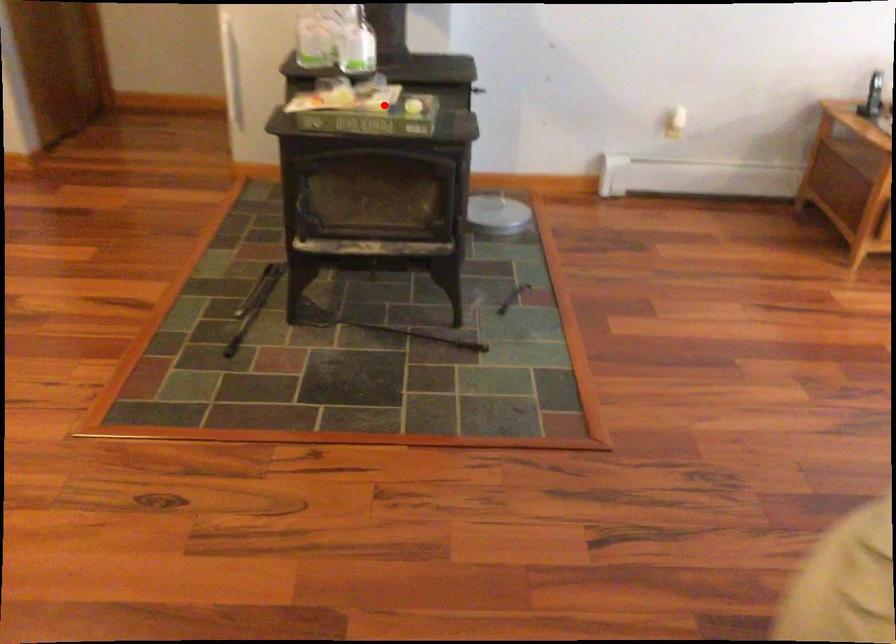
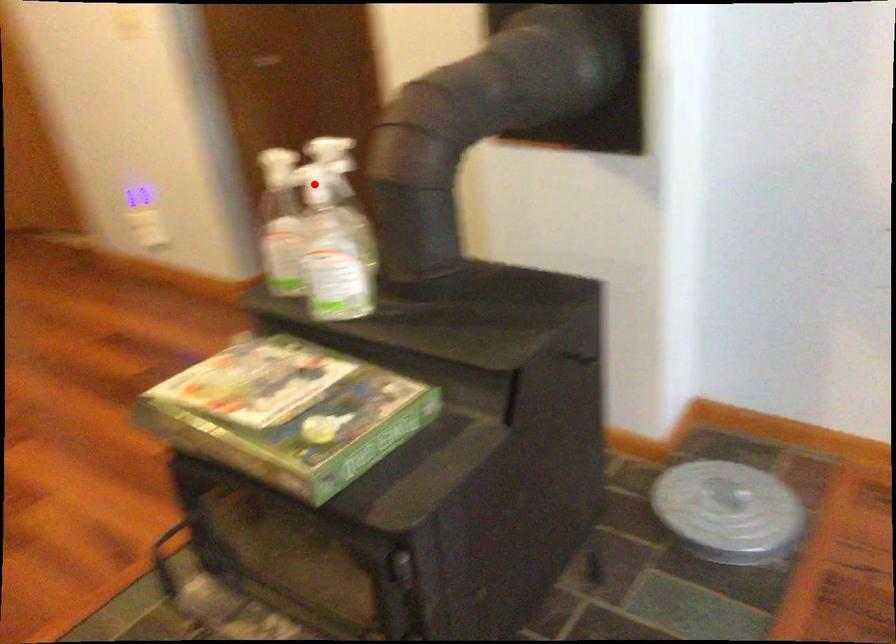
I am providing you with two images of the same scene from different viewpoints. A red point is marked on the first image and another point is marked on the second image. Are the points marked in image1 and image2 representing the same 3D position?

No